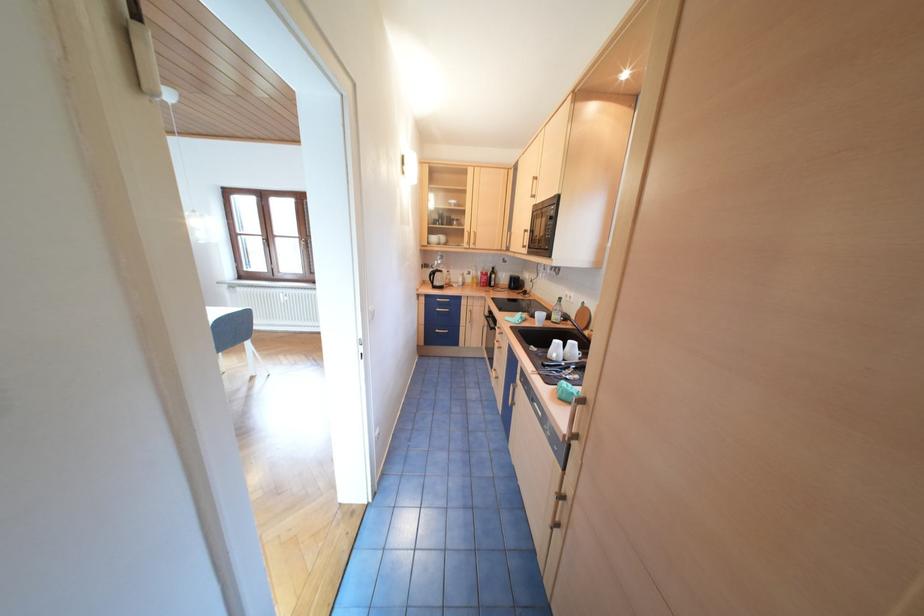
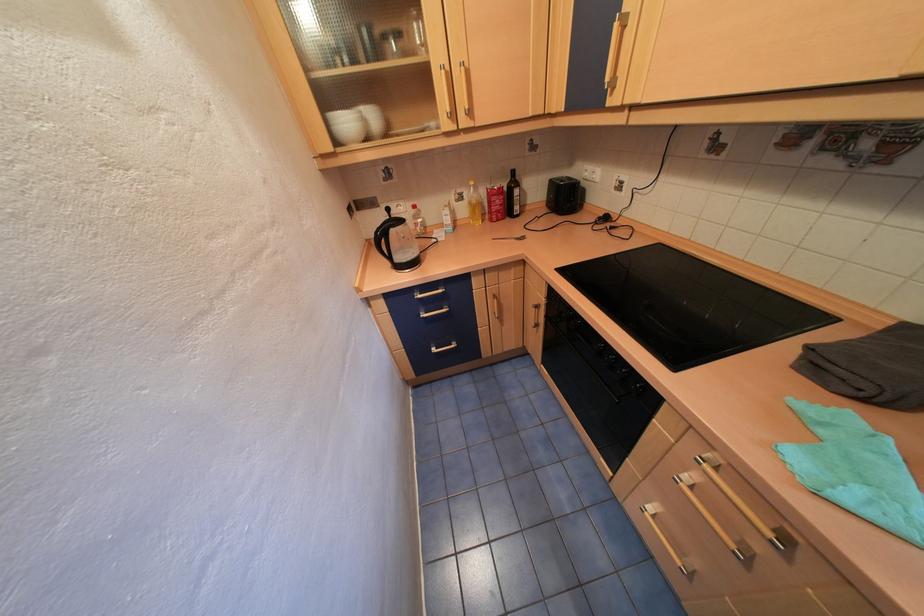
Question: Which direction would the cameraman need to move to produce the second image? Reply with the corresponding letter.

Choices:
 (A) Left
 (B) Right
 (C) Forward
 (D) Backward

Answer: (C)